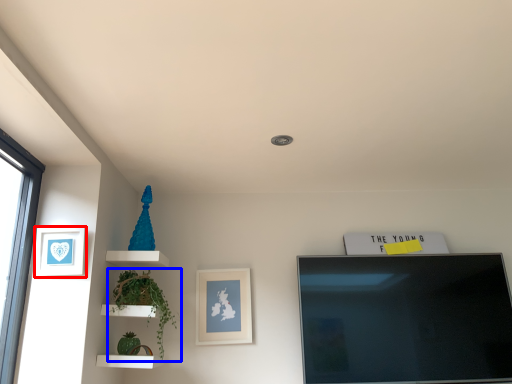
Question: Which of the following is the farthest to the observer, picture frame (highlighted by a red box) or plant (highlighted by a blue box)?

Choices:
 (A) picture frame
 (B) plant

Answer: (B)